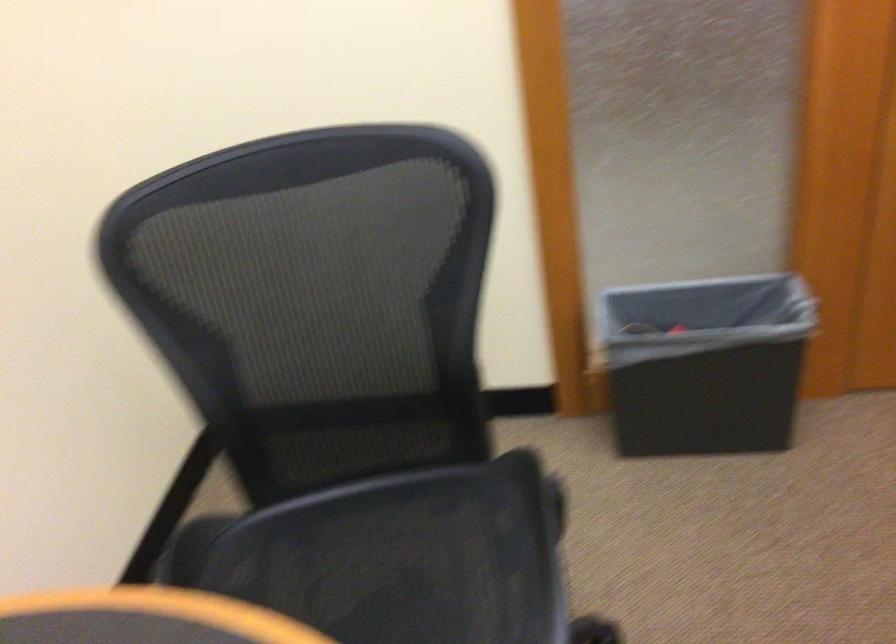
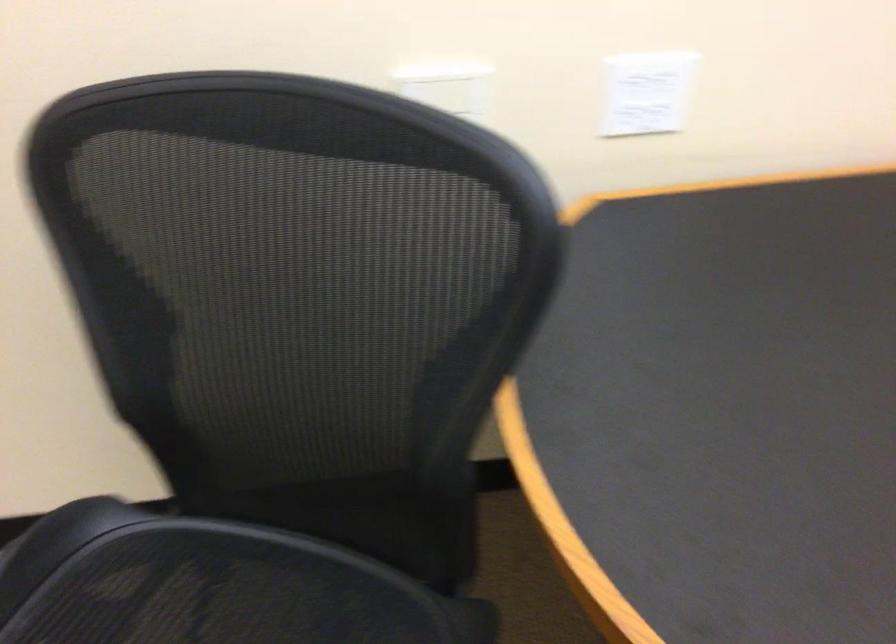
How did the camera likely rotate?

The camera's rotation is toward left-down.